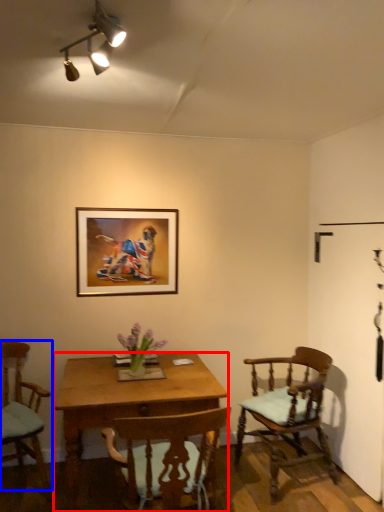
Question: Which point is further to the camera, desk (highlighted by a red box) or chair (highlighted by a blue box)?

Choices:
 (A) desk
 (B) chair

Answer: (B)